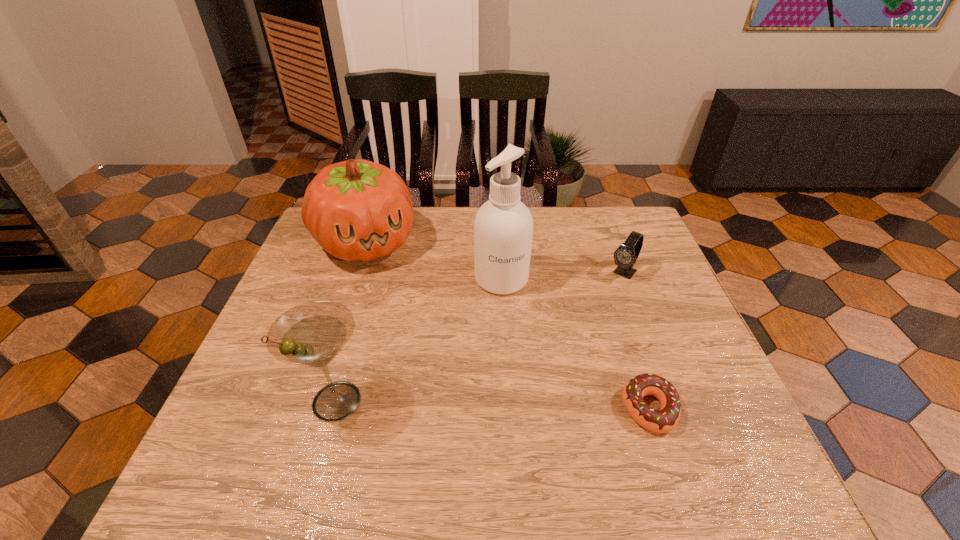
Locate an element on the screen. Image resolution: width=960 pixels, height=540 pixels. martini is located at coordinates (312, 334).

Identify the location of doughnut. The width and height of the screenshot is (960, 540). (664, 420).

Locate an element on the screen. This screenshot has height=540, width=960. watch is located at coordinates (625, 256).

Where is `pumpkin`? Image resolution: width=960 pixels, height=540 pixels. pumpkin is located at coordinates (357, 210).

The height and width of the screenshot is (540, 960). Find the location of `the third object from left to right`. the third object from left to right is located at coordinates (503, 228).

At what (x,y) coordinates should I click in order to perform the action: click on cleansing agent. Please return your answer as a coordinate pair (x, y). Image resolution: width=960 pixels, height=540 pixels. Looking at the image, I should click on (503, 228).

You are a GUI agent. You are given a task and a screenshot of the screen. Output one action in this format:
    pyautogui.click(x=<x>, y=<y>)
    Task: Click on the free space located on the right of the martini
    This screenshot has height=540, width=960.
    Given the screenshot: What is the action you would take?
    pyautogui.click(x=556, y=401)

At what (x,y) coordinates should I click in order to perform the action: click on free location located 0.250m on the left of the doughnut. Please return your answer as a coordinate pair (x, y). Looking at the image, I should click on pyautogui.click(x=503, y=409).

The height and width of the screenshot is (540, 960). I want to click on vacant space located 0.310m on the face of the fourth tallest object, so click(561, 350).

Locate an element on the screen. This screenshot has height=540, width=960. free space located on the face of the fourth tallest object is located at coordinates (609, 292).